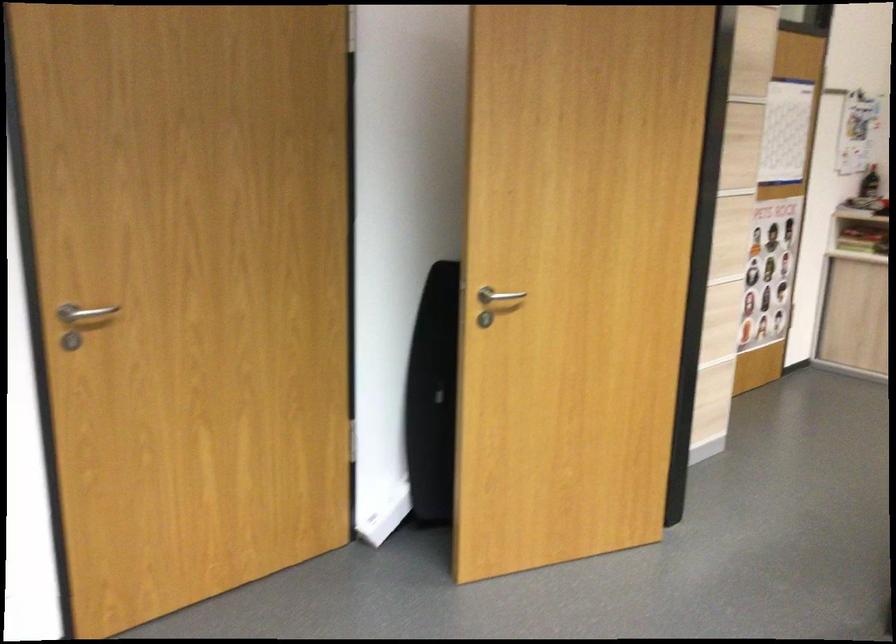
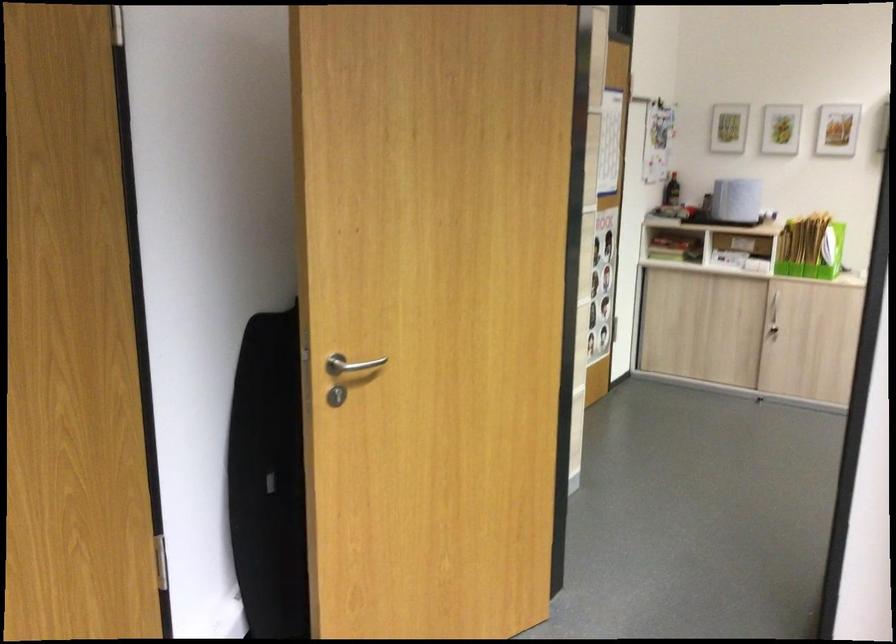
Question: How did the camera likely rotate?

Choices:
 (A) Left
 (B) Right
 (C) Up
 (D) Down

Answer: (B)